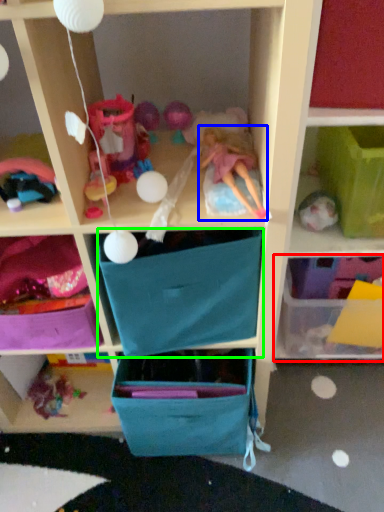
Question: Which object is positioned closest to shelf (highlighted by a red box)? Select from doll (highlighted by a blue box) and drawer (highlighted by a green box).

Choices:
 (A) doll
 (B) drawer

Answer: (B)